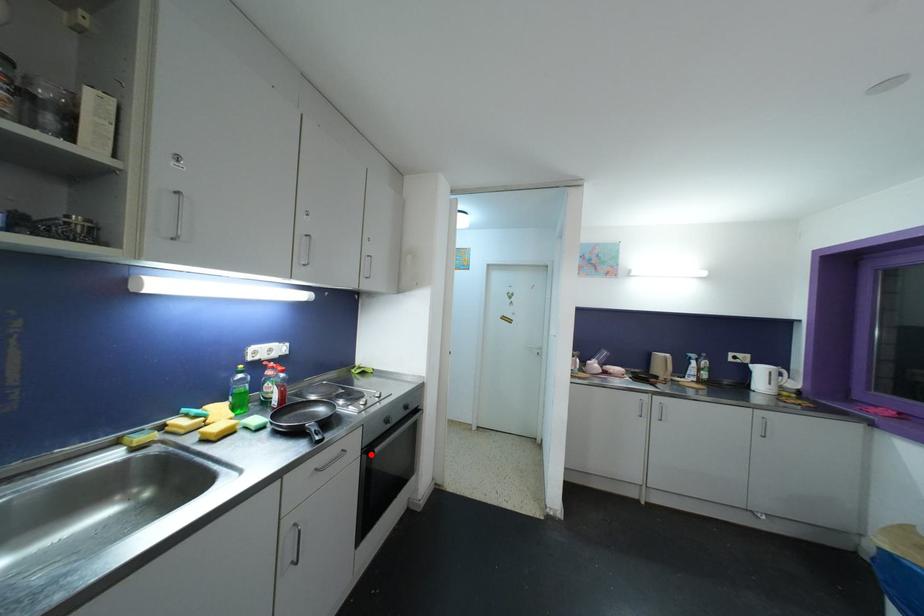
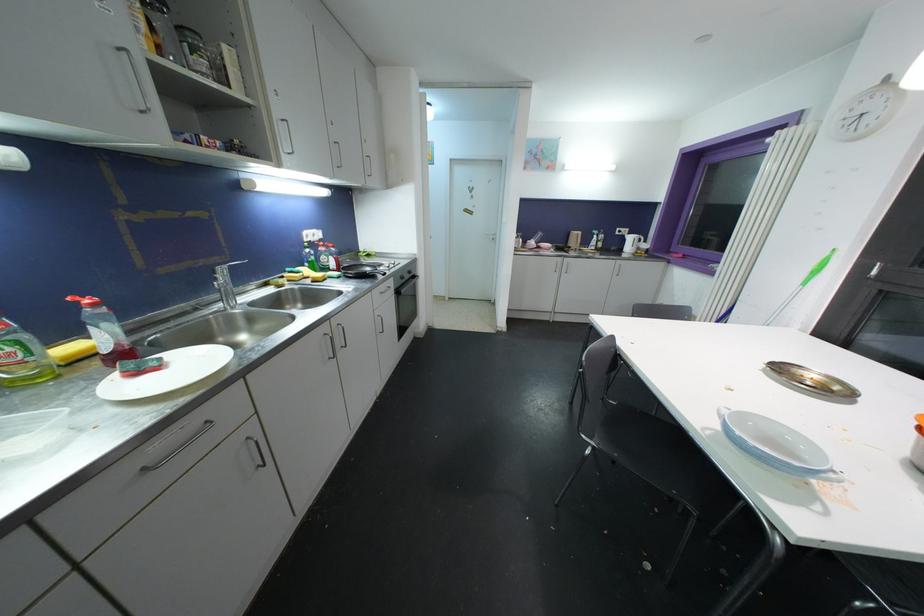
Question: I am providing you with two images of the same scene from different viewpoints. Given a red point in image1, look at the same physical point in image2. Is it:

Choices:
 (A) Closer to the viewpoint
 (B) Farther from the viewpoint

Answer: (A)